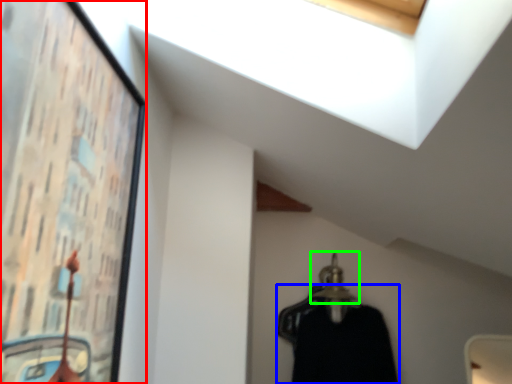
Question: Which object is positioned closest to picture frame (highlighted by a red box)? Select from clothing (highlighted by a blue box) and hanger (highlighted by a green box).

Choices:
 (A) clothing
 (B) hanger

Answer: (A)